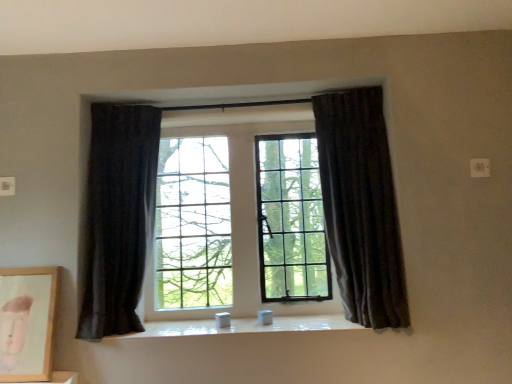
Question: From a real-world perspective, is dark velvet curtain at right, which ranks as the 1th curtain in right-to-left order, physically below matte wooden picture frame at lower left?

Choices:
 (A) no
 (B) yes

Answer: (A)

Question: Is dark velvet curtain at right, which ranks as the 1th curtain in right-to-left order, shorter than matte wooden picture frame at lower left?

Choices:
 (A) yes
 (B) no

Answer: (B)

Question: Does dark velvet curtain at right, which ranks as the 1th curtain in right-to-left order, lie behind matte wooden picture frame at lower left?

Choices:
 (A) yes
 (B) no

Answer: (A)

Question: Could you tell me if dark velvet curtain at right, arranged as the 2th curtain when viewed from the left, is turned towards matte wooden picture frame at lower left?

Choices:
 (A) no
 (B) yes

Answer: (A)

Question: From the image's perspective, would you say dark velvet curtain at right, arranged as the 2th curtain when viewed from the left, is shown under matte wooden picture frame at lower left?

Choices:
 (A) no
 (B) yes

Answer: (A)

Question: In terms of size, does dark velvet curtain at right, arranged as the 2th curtain when viewed from the left, appear bigger or smaller than dark fabric curtain at left, positioned as the 1th curtain in left-to-right order?

Choices:
 (A) small
 (B) big

Answer: (B)

Question: Considering the positions of dark velvet curtain at right, arranged as the 2th curtain when viewed from the left, and dark fabric curtain at left, arranged as the second curtain when viewed from the right, in the image, is dark velvet curtain at right, arranged as the 2th curtain when viewed from the left, wider or thinner than dark fabric curtain at left, arranged as the second curtain when viewed from the right,?

Choices:
 (A) thin
 (B) wide

Answer: (B)

Question: From the image's perspective, is dark velvet curtain at right, which ranks as the 1th curtain in right-to-left order, located above or below dark fabric curtain at left, arranged as the second curtain when viewed from the right?

Choices:
 (A) above
 (B) below

Answer: (A)

Question: Is dark velvet curtain at right, which ranks as the 1th curtain in right-to-left order, inside the boundaries of dark fabric curtain at left, arranged as the second curtain when viewed from the right, or outside?

Choices:
 (A) outside
 (B) inside

Answer: (A)

Question: Considering the positions of dark velvet curtain at right, which ranks as the 1th curtain in right-to-left order, and white glossy window sill at center in the image, is dark velvet curtain at right, which ranks as the 1th curtain in right-to-left order, taller or shorter than white glossy window sill at center?

Choices:
 (A) short
 (B) tall

Answer: (B)

Question: Choose the correct answer: Is dark velvet curtain at right, arranged as the 2th curtain when viewed from the left, inside white glossy window sill at center or outside it?

Choices:
 (A) outside
 (B) inside

Answer: (A)

Question: From a real-world perspective, is dark velvet curtain at right, which ranks as the 1th curtain in right-to-left order, positioned above or below white glossy window sill at center?

Choices:
 (A) above
 (B) below

Answer: (A)

Question: Looking at the image, does dark velvet curtain at right, which ranks as the 1th curtain in right-to-left order, seem bigger or smaller compared to white glossy window sill at center?

Choices:
 (A) small
 (B) big

Answer: (B)

Question: Which is correct: white glossy window sill at center is inside dark fabric curtain at left, positioned as the 1th curtain in left-to-right order, or outside of it?

Choices:
 (A) inside
 (B) outside

Answer: (B)

Question: Is point (239, 319) closer or farther from the camera than point (116, 198)?

Choices:
 (A) farther
 (B) closer

Answer: (A)